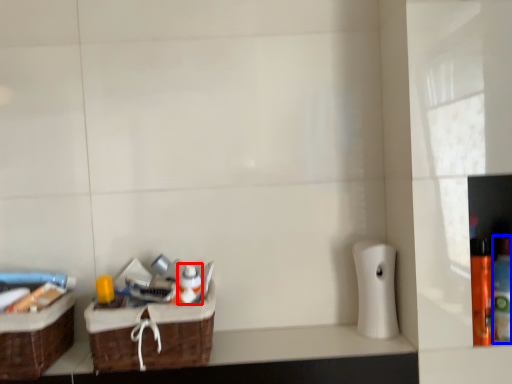
Question: Which object is further to the camera taking this photo, mouthwash (highlighted by a red box) or bottle (highlighted by a blue box)?

Choices:
 (A) mouthwash
 (B) bottle

Answer: (A)